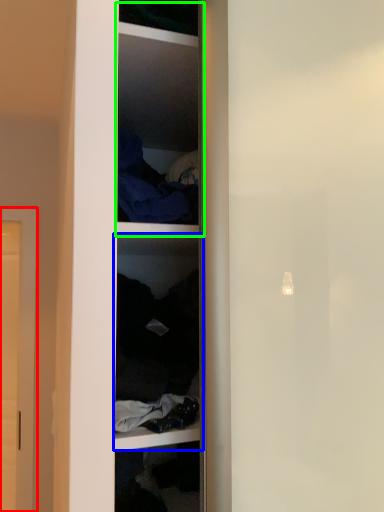
Question: Which object is the farthest from door (highlighted by a red box)? Choose among these: shelf (highlighted by a blue box) or cabinet (highlighted by a green box).

Choices:
 (A) shelf
 (B) cabinet

Answer: (B)